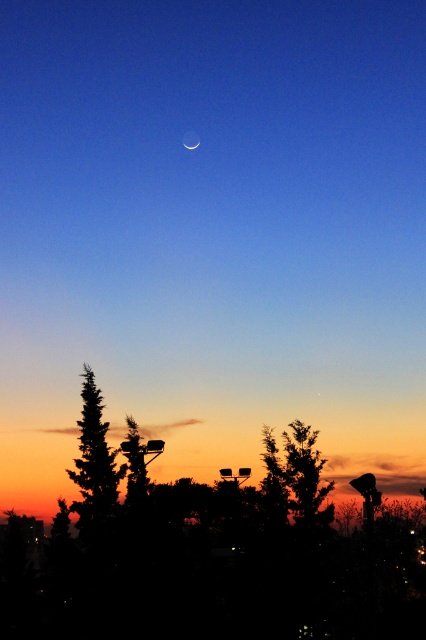
Question: Is green leafy tree at lower right wider than green leafy tree at lower left?

Choices:
 (A) yes
 (B) no

Answer: (A)

Question: Is silhouette tree at lower left below green leafy tree at lower right?

Choices:
 (A) no
 (B) yes

Answer: (A)

Question: Which object is closer to the camera taking this photo?

Choices:
 (A) green leafy tree at lower left
 (B) silhouette tree at lower left
 (C) matte white crescent at upper center
 (D) green leafy tree at lower right

Answer: (A)

Question: Estimate the real-world distances between objects in this image. Which object is closer to the matte white crescent at upper center?

Choices:
 (A) green leafy tree at lower left
 (B) silhouette tree at lower left
 (C) green leafy tree at lower right

Answer: (A)

Question: Is the position of silhouette tree at lower left more distant than that of green leafy tree at lower left?

Choices:
 (A) no
 (B) yes

Answer: (B)

Question: Among these points, which one is nearest to the camera?

Choices:
 (A) (118, 480)
 (B) (196, 144)
 (C) (127, 493)
 (D) (273, 468)

Answer: (C)